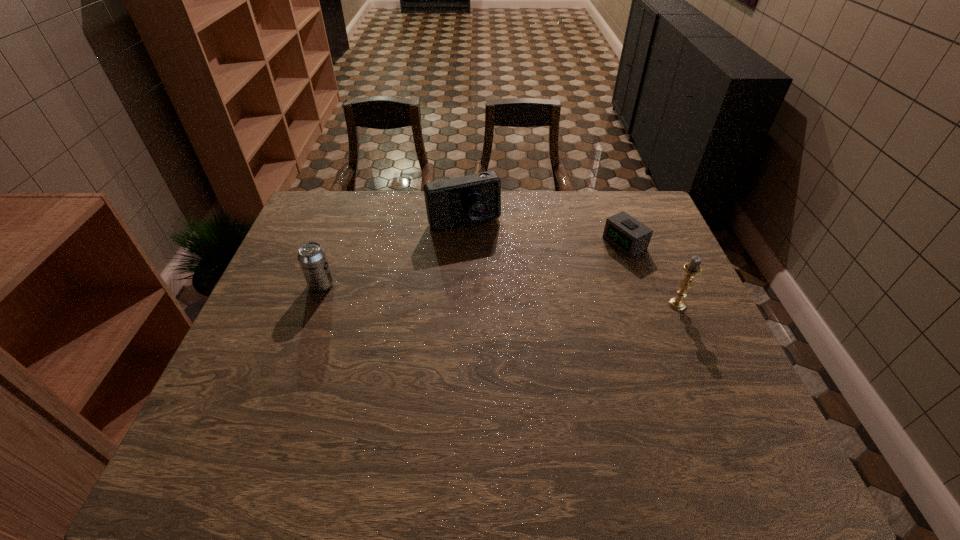
The width and height of the screenshot is (960, 540). I want to click on free region located on the front-facing side of the alarm clock, so click(586, 264).

You are a GUI agent. You are given a task and a screenshot of the screen. Output one action in this format:
    pyautogui.click(x=<x>, y=<y>)
    Task: Click on the free point located on the front-facing side of the alarm clock
    Image resolution: width=960 pixels, height=540 pixels.
    Given the screenshot: What is the action you would take?
    pyautogui.click(x=557, y=278)

Locate an element on the screen. This screenshot has width=960, height=540. vacant space located on the front-facing side of the alarm clock is located at coordinates (533, 290).

Image resolution: width=960 pixels, height=540 pixels. I want to click on camera present at the far edge, so click(x=459, y=201).

Image resolution: width=960 pixels, height=540 pixels. In order to click on alarm clock located at the far edge in this screenshot , I will do `click(630, 236)`.

Image resolution: width=960 pixels, height=540 pixels. Identify the location of object that is at the left edge. (312, 258).

The height and width of the screenshot is (540, 960). Identify the location of candle holder present at the right edge. (692, 269).

Where is `alarm clock positioned at the right edge`? Image resolution: width=960 pixels, height=540 pixels. alarm clock positioned at the right edge is located at coordinates (630, 236).

The image size is (960, 540). I want to click on object present at the far right corner, so click(x=630, y=236).

In the image, there is a desktop. What are the coordinates of `vacant space at the far edge` in the screenshot? It's located at (393, 233).